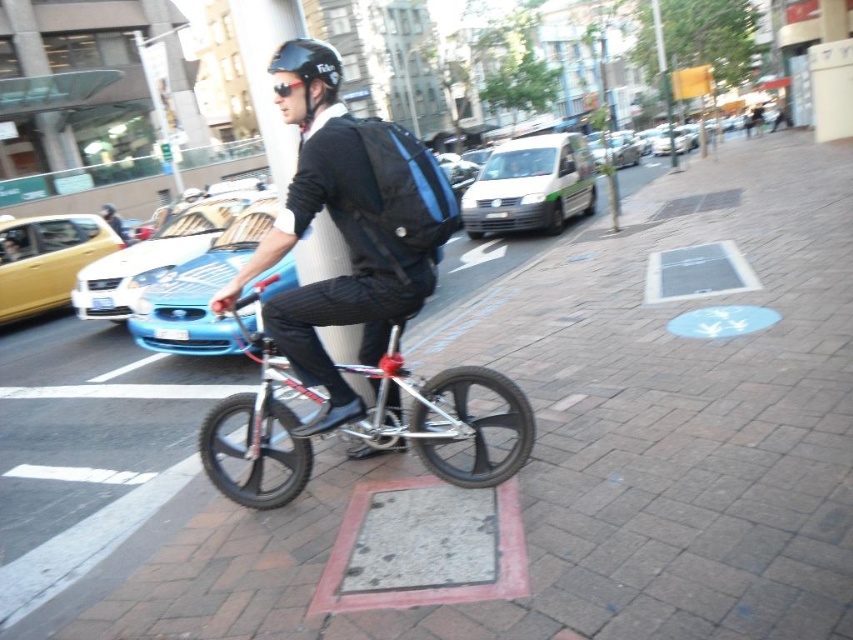
You are a delivery person who needs to choose between the silver metallic bicycle at center and the metallic blue monocycle at center. Which one is positioned lower from the ground?

A: The silver metallic bicycle at center is positioned lower from the ground than the metallic blue monocycle at center.

You are a delivery person who needs to attach a GPS tracker to the silver metallic bicycle at center. The tracker has a diameter of 10 centimeters. Can you place it on the matte black backpack at center without overlapping the bicycle?

The matte black backpack at center is 23.20 centimeters away from the silver metallic bicycle at center. Since the GPS tracker has a diameter of 10 centimeters, placing it on the backpack would leave enough space between the backpack and the bicycle, so yes, it can be placed there without overlapping.

You are a cyclist navigating a busy city sidewalk. You notice two points marked on your path. The first point is at coordinates point (x=461, y=483), and the second point is at point (x=229, y=328). Which point should you reach first while moving forward?

Point (x=461, y=483) is in front of point (x=229, y=328), so you should reach point (x=461, y=483) first while moving forward.